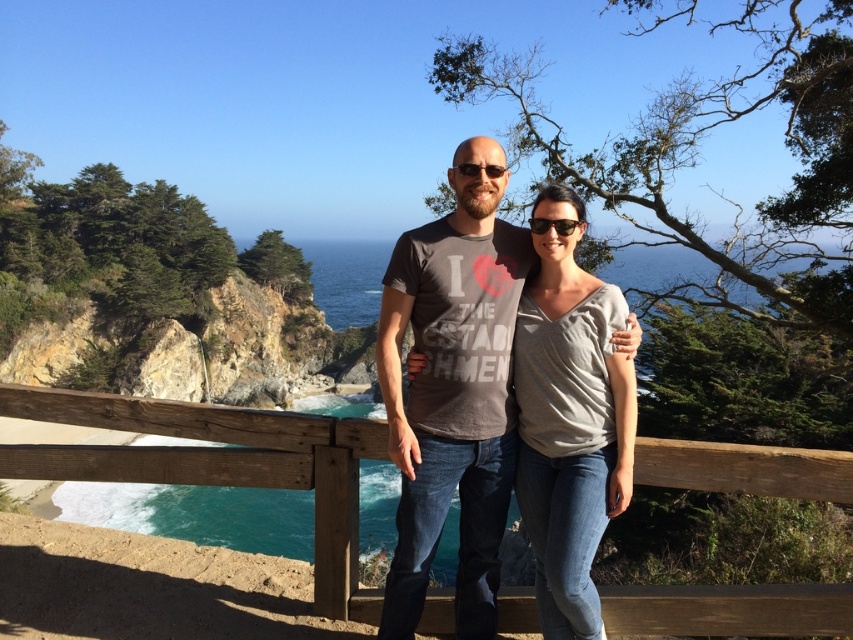
Looking at this image, can you confirm if wooden at center is shorter than gray cotton shirt at center?

No.

Can you confirm if wooden at center is positioned to the left of gray cotton shirt at center?

Correct, you'll find wooden at center to the left of gray cotton shirt at center.

Image resolution: width=853 pixels, height=640 pixels. Describe the element at coordinates (218, 465) in the screenshot. I see `wooden at center` at that location.

Identify the location of wooden at center. The image size is (853, 640). (218, 465).

Between wooden at center and dark gray t-shirt at center, which one has more height?

dark gray t-shirt at center

Between wooden at center and dark gray t-shirt at center, which one is positioned higher?

wooden at center is above.

Describe the element at coordinates (218, 465) in the screenshot. I see `wooden at center` at that location.

Image resolution: width=853 pixels, height=640 pixels. I want to click on wooden at center, so click(218, 465).

Is the position of dark gray t-shirt at center less distant than that of gray cotton shirt at center?

Yes, dark gray t-shirt at center is closer to the viewer.

Locate an element on the screen. This screenshot has width=853, height=640. dark gray t-shirt at center is located at coordinates (453, 390).

Between point (444, 438) and point (592, 452), which one is positioned in front?

Point (592, 452)

The image size is (853, 640). I want to click on dark gray t-shirt at center, so click(453, 390).